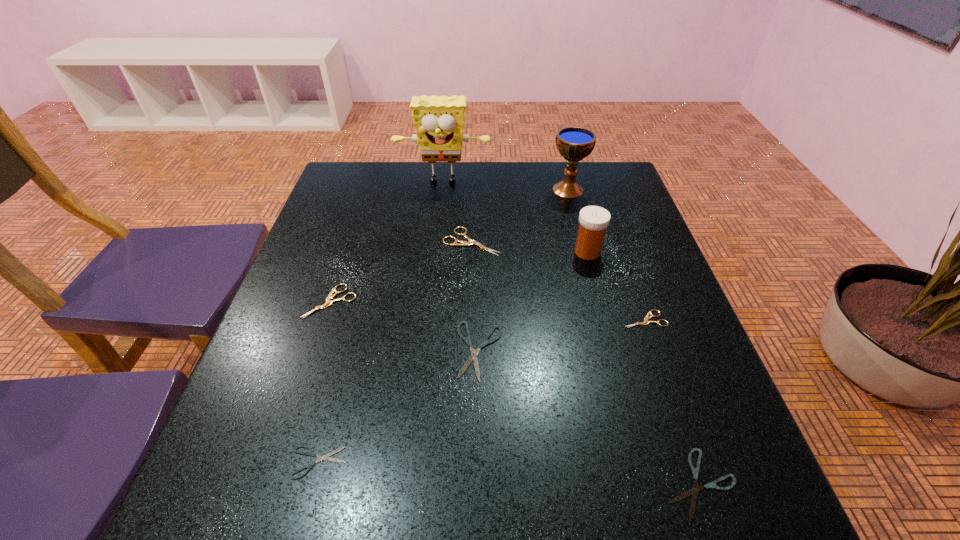
I want to click on vacant space that satisfies the following two spatial constraints: 1. on the front-facing side of the sponge; 2. on the right side of the second beige shears from left to right, so click(436, 241).

Find the location of `vacant position in the image that satisfies the following two spatial constraints: 1. on the back side of the eighth shortest object; 2. on the left side of the shortest object`. vacant position in the image that satisfies the following two spatial constraints: 1. on the back side of the eighth shortest object; 2. on the left side of the shortest object is located at coordinates (390, 190).

This screenshot has height=540, width=960. What are the coordinates of `vacant space that satisfies the following two spatial constraints: 1. on the front side of the fifth shortest object; 2. on the left side of the rightmost black shears` in the screenshot? It's located at (272, 483).